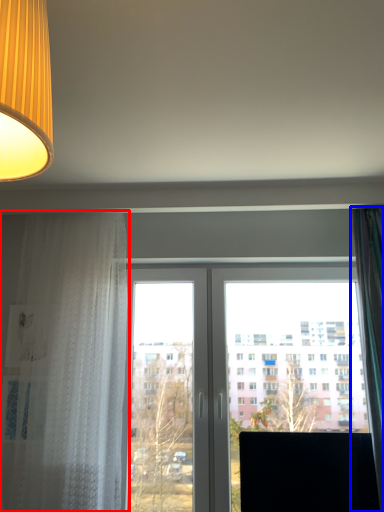
Question: Which point is further to the camera, curtain (highlighted by a red box) or curtain (highlighted by a blue box)?

Choices:
 (A) curtain
 (B) curtain

Answer: (A)